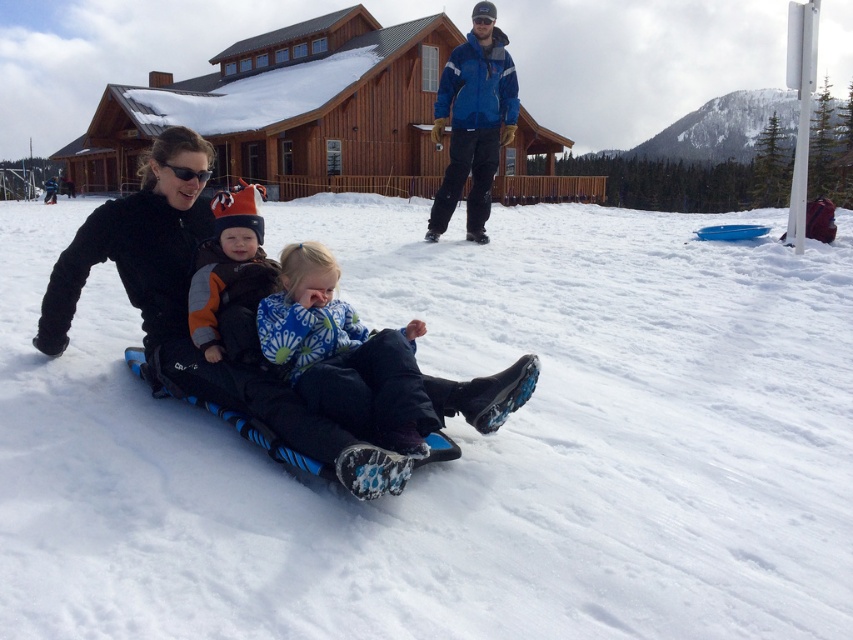
You are standing at the bottom of the slope and want to take a photo of the white snow at center and the black fleece jacket at lower left. Which object will appear larger in your photo?

The white snow at center will appear larger in the photo because it is closer to the viewer compared to the black fleece jacket at lower left.

You are standing at the center of the image and want to find the black fleece jacket at lower left. According to the coordinates provided, in which direction should you look to locate it?

The black fleece jacket at lower left is located at coordinates point (138,250), which means it is positioned to the lower left from your current position at the center. You should look towards the lower left direction to find it.

You are standing at the center of the image and want to locate the blue fleece jacket at center. Based on the coordinates provided, in which direction should you look to find it?

The blue fleece jacket at center is located at coordinates point (344, 355), so you should look slightly to the right and down from the very center of the image to find it.